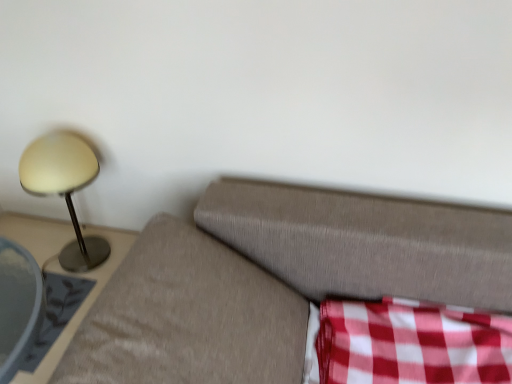
Question: From a real-world perspective, is matte gold lamp at left located beneath red checkered fabric at lower right?

Choices:
 (A) yes
 (B) no

Answer: (B)

Question: Considering the relative sizes of matte gold lamp at left and red checkered fabric at lower right in the image provided, is matte gold lamp at left smaller than red checkered fabric at lower right?

Choices:
 (A) yes
 (B) no

Answer: (A)

Question: Is matte gold lamp at left in front of red checkered fabric at lower right?

Choices:
 (A) no
 (B) yes

Answer: (A)

Question: Is matte gold lamp at left not inside red checkered fabric at lower right?

Choices:
 (A) no
 (B) yes

Answer: (B)

Question: Does matte gold lamp at left have a greater width compared to red checkered fabric at lower right?

Choices:
 (A) yes
 (B) no

Answer: (B)

Question: Does matte gold lamp at left appear on the left side of red checkered fabric at lower right?

Choices:
 (A) no
 (B) yes

Answer: (B)

Question: Is red checkered fabric at lower right smaller than matte gold lamp at left?

Choices:
 (A) yes
 (B) no

Answer: (B)

Question: From a real-world perspective, is red checkered fabric at lower right located beneath matte gold lamp at left?

Choices:
 (A) yes
 (B) no

Answer: (A)

Question: Is red checkered fabric at lower right closer to camera compared to matte gold lamp at left?

Choices:
 (A) no
 (B) yes

Answer: (B)

Question: Does red checkered fabric at lower right lie behind matte gold lamp at left?

Choices:
 (A) no
 (B) yes

Answer: (A)

Question: Are red checkered fabric at lower right and matte gold lamp at left making contact?

Choices:
 (A) yes
 (B) no

Answer: (B)

Question: Is red checkered fabric at lower right aimed at matte gold lamp at left?

Choices:
 (A) yes
 (B) no

Answer: (B)

Question: Is matte gold lamp at left at the left side of metallic gray side table at left?

Choices:
 (A) yes
 (B) no

Answer: (B)